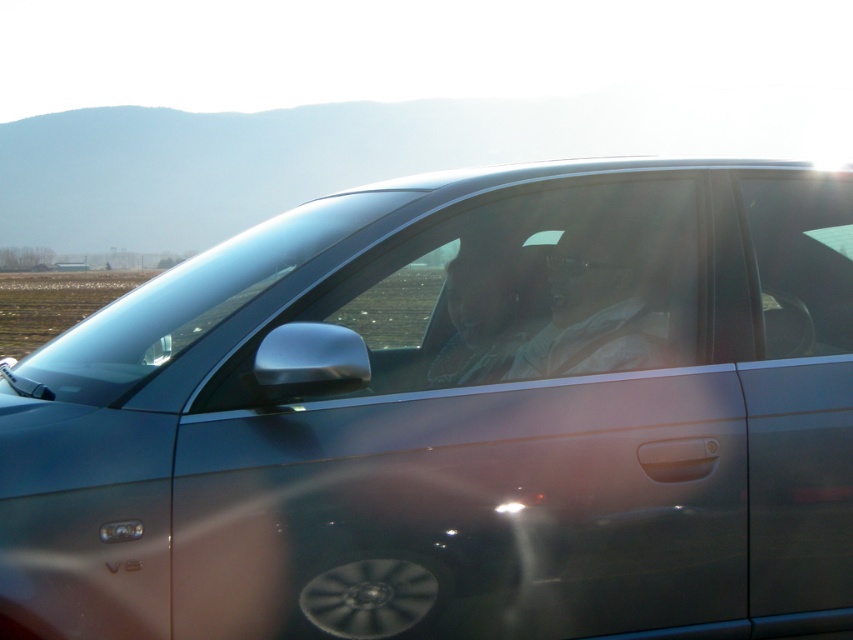
Between matte gray shirt at center and matte plastic face at center, which one is positioned higher?

matte plastic face at center is higher up.

Consider the image. Which of these two, matte gray shirt at center or matte plastic face at center, stands taller?

matte gray shirt at center

Who is more forward, (x=599, y=284) or (x=502, y=368)?

Positioned in front is point (x=502, y=368).

At what (x,y) coordinates should I click in order to perform the action: click on matte gray shirt at center. Please return your answer as a coordinate pair (x, y). This screenshot has height=640, width=853. Looking at the image, I should click on (601, 301).

Is point (527, 209) farther from camera compared to point (498, 269)?

Yes, point (527, 209) is farther from viewer.

Between transparent glass window at center and matte plastic face at center, which one has less height?

With less height is matte plastic face at center.

Which is in front, point (665, 212) or point (529, 317)?

Point (529, 317) is more forward.

I want to click on transparent glass window at center, so click(x=495, y=300).

Is transparent glass window at center positioned behind matte gray shirt at center?

No, it is not.

Is transparent glass window at center bigger than matte gray shirt at center?

Correct, transparent glass window at center is larger in size than matte gray shirt at center.

This screenshot has width=853, height=640. Find the location of `transparent glass window at center`. transparent glass window at center is located at coordinates (495, 300).